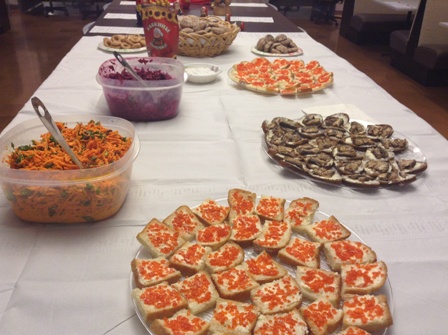
Locate an element on the screen. This screenshot has height=335, width=448. basket is located at coordinates (220, 48).